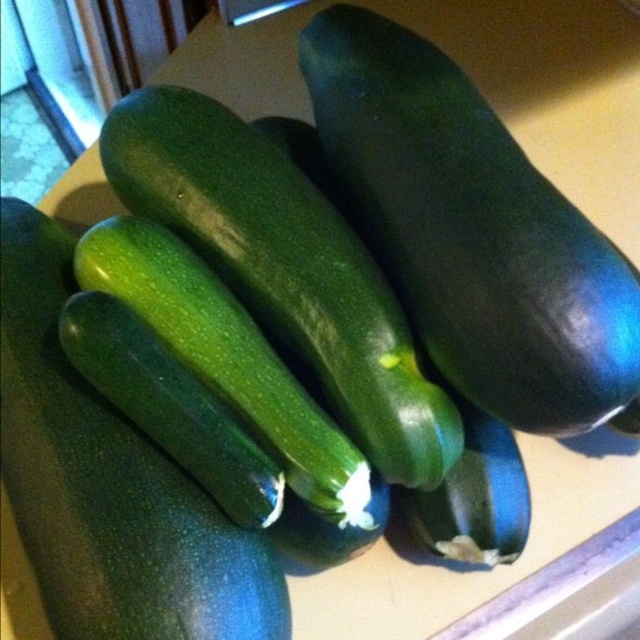
You are organizing vegetables on a kitchen counter and see the green matte cucumber at center and the green smooth zucchini at center. Which vegetable is positioned higher up?

The green matte cucumber at center is positioned above the green smooth zucchini at center, so it is higher up.

You are taking a photo of the zucchinis on the countertop. You want to focus on the point at point (470, 376) and point (240, 198). Which point should you focus on first to ensure both are in focus?

You should focus on point (470, 376) first because it is closer to the camera than point (240, 198), so adjusting focus starting from the closer point ensures both points will be in focus.